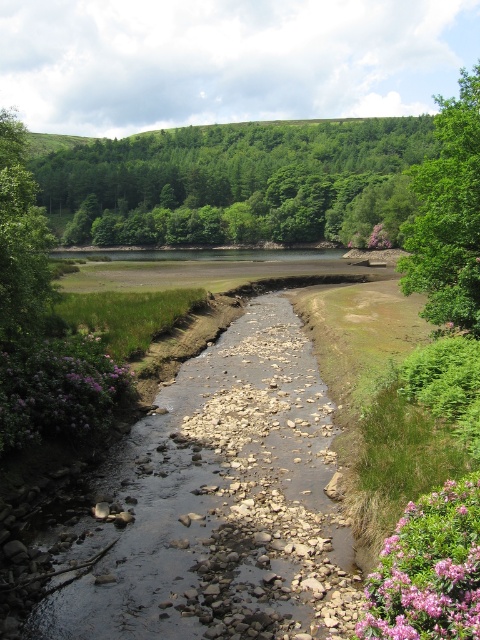
Question: Among these objects, which one is nearest to the camera?

Choices:
 (A) green leafy tree at right
 (B) pink matte flowers at lower right
 (C) green leafy tree at upper left
 (D) purple matte flower at center-right

Answer: (B)

Question: Is the position of purple fuzzy bush at lower left more distant than that of green leafy tree at upper left?

Choices:
 (A) no
 (B) yes

Answer: (A)

Question: Does green leafy trees at upper center have a larger size compared to green leafy tree at right?

Choices:
 (A) no
 (B) yes

Answer: (B)

Question: Does green leafy trees at upper center appear over purple fuzzy bush at lower left?

Choices:
 (A) yes
 (B) no

Answer: (A)

Question: Which object is closer to the camera taking this photo?

Choices:
 (A) pink matte flowers at lower right
 (B) purple matte flower at center-right
 (C) purple fuzzy bush at lower left
 (D) green leafy tree at right

Answer: (A)

Question: Among these objects, which one is farthest from the camera?

Choices:
 (A) purple fuzzy bush at lower left
 (B) green leafy tree at right
 (C) green leafy tree at upper left
 (D) purple matte flower at center-right

Answer: (D)